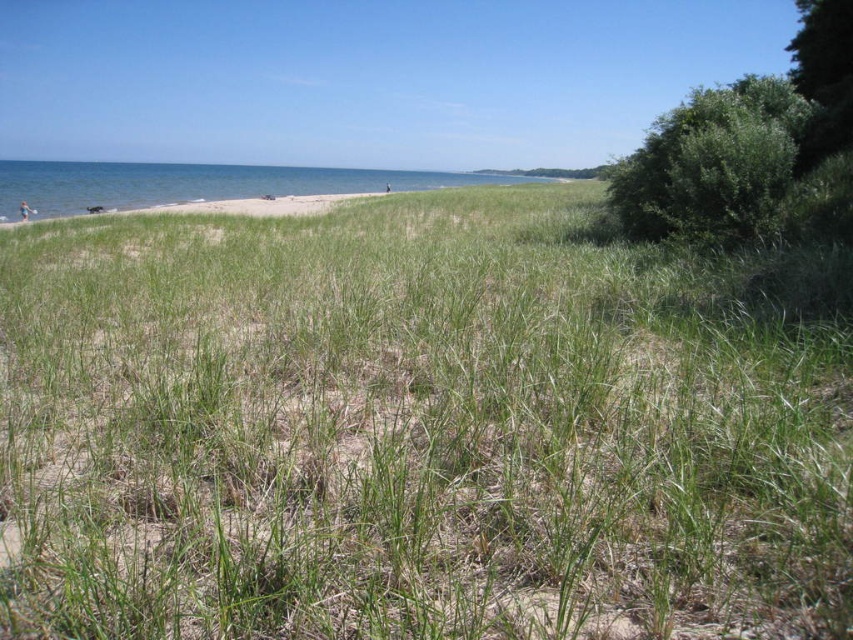
You are a drone operator tasked with capturing aerial footage of the coastal landscape. The drone has a maximum flight range of 50 meters from its starting position. If you position the drone above the green grassy at center, will it be able to capture the blue water at upper left within its range?

The distance between the green grassy at center and the blue water at upper left is 47.61 meters, which is within the drone operator maximum flight range of 50 meters. Therefore, the drone can capture the blue water at upper left while positioned above the green grassy at center.

You are standing at the point marked by the coordinates point (410,432) in the image. Looking around, what do you see immediately around you?

The point (410,432) indicates green grassy at center, so you are standing in the green grassy area at the center of the image.

You are standing on the beach and want to walk towards the blue water at upper left. Which direction should you face if you are currently facing the green grassy at center?

Since the green grassy at center is to the right of the blue water at upper left, you should turn to your left to face the blue water at upper left.